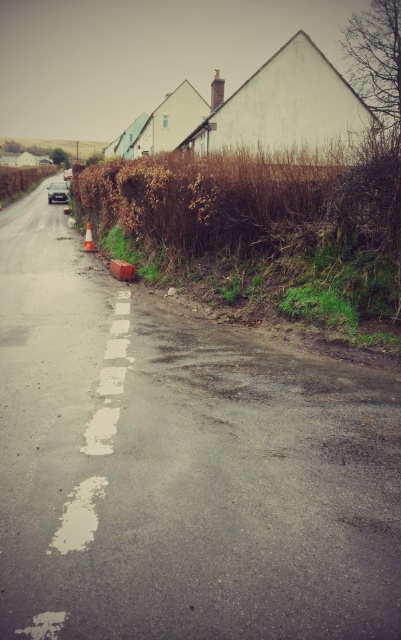
Who is higher up, brown dry hedge at upper right or orange reflective cone at lower center?

brown dry hedge at upper right

Can you confirm if brown dry hedge at upper right is bigger than orange reflective cone at lower center?

Yes, brown dry hedge at upper right is bigger than orange reflective cone at lower center.

Is point (236, 182) closer to camera compared to point (83, 244)?

Yes.

Locate an element on the screen. The width and height of the screenshot is (401, 640). brown dry hedge at upper right is located at coordinates (263, 211).

Who is shorter, brown dry hedge at upper right or brown dry hedge at left?

With less height is brown dry hedge at upper right.

Is brown dry hedge at upper right taller than brown dry hedge at left?

Incorrect, brown dry hedge at upper right's height is not larger of brown dry hedge at left's.

Does point (269, 209) come closer to viewer compared to point (36, 182)?

Yes.

In order to click on brown dry hedge at upper right in this screenshot , I will do `click(263, 211)`.

The height and width of the screenshot is (640, 401). Describe the element at coordinates (20, 180) in the screenshot. I see `brown dry hedge at left` at that location.

Who is positioned more to the right, brown dry hedge at left or orange reflective cone at lower center?

orange reflective cone at lower center is more to the right.

Which is in front, point (54, 170) or point (87, 221)?

Point (87, 221)

In order to click on brown dry hedge at left in this screenshot , I will do `click(20, 180)`.